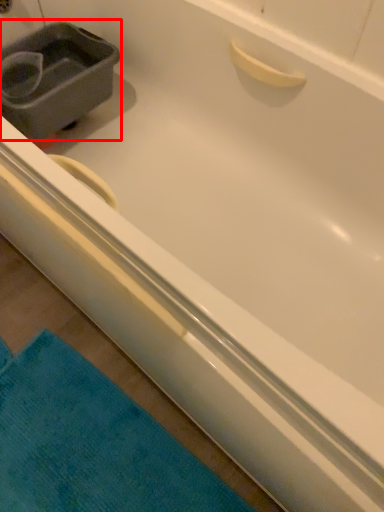
Question: From the image's perspective, what is the correct spatial positioning of sink (annotated by the red box) in reference to bath towel?

Choices:
 (A) below
 (B) above

Answer: (B)